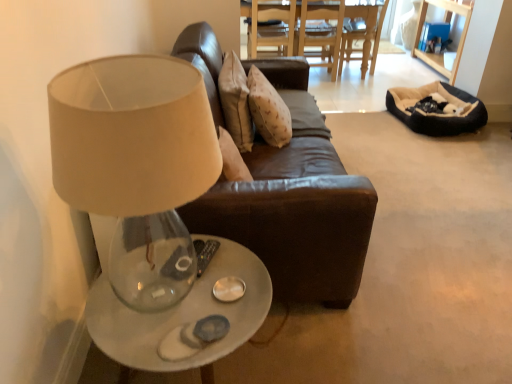
Find the location of a particular element. The width and height of the screenshot is (512, 384). beige plush bean bag at right is located at coordinates (437, 114).

This screenshot has width=512, height=384. What do you see at coordinates (182, 315) in the screenshot?
I see `translucent glass table at lower left, which is counted as the second table, starting from the right` at bounding box center [182, 315].

Identify the location of wooden dining table at center, the 1th table from the right. (362, 33).

Measure the distance between point (61, 177) and camera.

Point (61, 177) and camera are 36.34 inches apart.

Describe the element at coordinates (236, 102) in the screenshot. I see `beige fabric pillow at center` at that location.

The image size is (512, 384). Find the location of `beige fabric pillow at center`. beige fabric pillow at center is located at coordinates (236, 102).

This screenshot has width=512, height=384. I want to click on beige plush bean bag at right, so click(437, 114).

At what (x,y) coordinates should I click in order to perform the action: click on pillow below the wooden dining table at center, which is the 2th table in front-to-back order (from the image's perspective). Please return your answer as a coordinate pair (x, y). The image size is (512, 384). Looking at the image, I should click on (236, 102).

Which point is more distant from viewer, (377, 51) or (243, 119)?

Positioned behind is point (377, 51).

Choose the correct answer: Is wooden dining table at center, placed as the 1th table when sorted from back to front, inside beige fabric pillow at center or outside it?

wooden dining table at center, placed as the 1th table when sorted from back to front, is not inside beige fabric pillow at center, it's outside.

Is wooden dining table at center, placed as the second table when sorted from left to right, directly adjacent to beige fabric pillow at center?

No, wooden dining table at center, placed as the second table when sorted from left to right, is not with beige fabric pillow at center.

Is wooden dining table at center, which is the 2th table in front-to-back order, at the right side of brown leather chair at upper center?

Yes.

Considering the sizes of objects wooden dining table at center, placed as the second table when sorted from left to right, and brown leather chair at upper center in the image provided, who is thinner, wooden dining table at center, placed as the second table when sorted from left to right, or brown leather chair at upper center?

brown leather chair at upper center.

Are wooden dining table at center, placed as the 1th table when sorted from back to front, and brown leather chair at upper center located far from each other?

No.

From a real-world perspective, is translucent glass table at lower left, which is the second table in top-to-bottom order, physically located above or below wooden dining table at center, which is the 2th table in front-to-back order?

Clearly, from a real-world perspective, translucent glass table at lower left, which is the second table in top-to-bottom order, is below wooden dining table at center, which is the 2th table in front-to-back order.

From the image's perspective, between translucent glass table at lower left, which is counted as the second table, starting from the right, and wooden dining table at center, placed as the 2th table when sorted from bottom to top, which one is located above?

wooden dining table at center, placed as the 2th table when sorted from bottom to top, appears higher in the image.

Where is `table above the translucent glass table at lower left, positioned as the first table in front-to-back order (from the image's perspective)`? table above the translucent glass table at lower left, positioned as the first table in front-to-back order (from the image's perspective) is located at coordinates (362, 33).

Is translucent glass table at lower left, acting as the 2th table starting from the back, in front of or behind wooden dining table at center, placed as the 2th table when sorted from bottom to top, in the image?

Clearly, translucent glass table at lower left, acting as the 2th table starting from the back, is in front of wooden dining table at center, placed as the 2th table when sorted from bottom to top.

From the image's perspective, relative to translucent glass table at lower left, positioned as the first table in front-to-back order, is brown leather chair at upper center above or below?

Clearly, from the image's perspective, brown leather chair at upper center is above translucent glass table at lower left, positioned as the first table in front-to-back order.

Does brown leather chair at upper center have a greater height compared to translucent glass table at lower left, which is the second table in top-to-bottom order?

Yes.

From a real-world perspective, is brown leather chair at upper center physically above translucent glass table at lower left, which is the second table in top-to-bottom order?

Yes, from a real-world perspective, brown leather chair at upper center is above translucent glass table at lower left, which is the second table in top-to-bottom order.

Where is `chair on the right of translucent glass table at lower left, acting as the 2th table starting from the back`? This screenshot has height=384, width=512. chair on the right of translucent glass table at lower left, acting as the 2th table starting from the back is located at coordinates (269, 26).

Which object is wider, translucent glass table at lower left, the 1th table from the bottom, or beige fabric lampshade at upper left?

translucent glass table at lower left, the 1th table from the bottom, is wider.

Would you say translucent glass table at lower left, which is the second table in top-to-bottom order, contains beige fabric lampshade at upper left?

No, beige fabric lampshade at upper left is not inside translucent glass table at lower left, which is the second table in top-to-bottom order.

Which is in front, brown leather chair at upper center or wooden dining table at center, placed as the 2th table when sorted from bottom to top?

brown leather chair at upper center is more forward.

Between brown leather chair at upper center and wooden dining table at center, the first table from the top, which one has less height?

brown leather chair at upper center is shorter.

I want to click on table lying above the brown leather chair at upper center (from the image's perspective), so click(x=362, y=33).

From a real-world perspective, is brown leather chair at upper center beneath wooden dining table at center, placed as the second table when sorted from left to right?

Actually, brown leather chair at upper center is physically above wooden dining table at center, placed as the second table when sorted from left to right, in the real world.

Is beige fabric lampshade at upper left inside the boundaries of brown leather chair at upper center, or outside?

beige fabric lampshade at upper left exists outside the volume of brown leather chair at upper center.

Which is farther, (142, 125) or (259, 5)?

The point (259, 5) is more distant.

Who is taller, beige fabric lampshade at upper left or brown leather chair at upper center?

Standing taller between the two is beige fabric lampshade at upper left.

Locate an element on the screen. table that is on the right side of beige fabric pillow at center is located at coordinates (362, 33).

At what (x,y) coordinates should I click in order to perform the action: click on table above the brown leather chair at upper center (from the image's perspective). Please return your answer as a coordinate pair (x, y). Looking at the image, I should click on (362, 33).

Which object lies nearer to the anchor point beige plush bean bag at right, brown leather chair at upper center or translucent glass table at lower left, which ranks as the 1th table in left-to-right order?

brown leather chair at upper center is positioned closer to the anchor beige plush bean bag at right.

Which object lies nearer to the anchor point beige fabric lampshade at upper left, beige fabric pillow at center or wooden dining table at center, the 1th table from the right?

Based on the image, beige fabric pillow at center appears to be nearer to beige fabric lampshade at upper left.

Considering their positions, is beige plush bean bag at right positioned closer to beige fabric pillow at center than translucent glass table at lower left, which ranks as the 1th table in left-to-right order?

Among the two, translucent glass table at lower left, which ranks as the 1th table in left-to-right order, is located nearer to beige fabric pillow at center.

Which object lies nearer to the anchor point beige fabric lampshade at upper left, translucent glass table at lower left, which is the second table in top-to-bottom order, or beige plush bean bag at right?

translucent glass table at lower left, which is the second table in top-to-bottom order.

From the picture: Considering their positions, is beige fabric lampshade at upper left positioned closer to wooden dining table at center, placed as the 2th table when sorted from bottom to top, than brown leather chair at upper center?

Based on the image, brown leather chair at upper center appears to be nearer to wooden dining table at center, placed as the 2th table when sorted from bottom to top.

Estimate the real-world distances between objects in this image. Which object is further from translucent glass table at lower left, positioned as the first table in front-to-back order, beige plush bean bag at right or beige fabric lampshade at upper left?

beige plush bean bag at right is positioned further to the anchor translucent glass table at lower left, positioned as the first table in front-to-back order.

Looking at the image, which one is located further to beige fabric pillow at center, beige fabric lampshade at upper left or wooden dining table at center, the first table from the top?

wooden dining table at center, the first table from the top, lies further to beige fabric pillow at center than the other object.

From the image, which object appears to be farther from brown leather chair at upper center, beige fabric pillow at center or wooden dining table at center, the first table from the top?

beige fabric pillow at center is further to brown leather chair at upper center.

The width and height of the screenshot is (512, 384). In order to click on pillow between beige fabric lampshade at upper left and wooden dining table at center, placed as the 1th table when sorted from back to front, from front to back in this screenshot , I will do `click(236, 102)`.

The width and height of the screenshot is (512, 384). Find the location of `bean bag chair located between beige fabric pillow at center and wooden dining table at center, placed as the second table when sorted from left to right, in the depth direction`. bean bag chair located between beige fabric pillow at center and wooden dining table at center, placed as the second table when sorted from left to right, in the depth direction is located at coordinates (437, 114).

At what (x,y) coordinates should I click in order to perform the action: click on pillow positioned between translucent glass table at lower left, the 1th table from the bottom, and wooden dining table at center, the 1th table from the right, from near to far. Please return your answer as a coordinate pair (x, y). The width and height of the screenshot is (512, 384). Looking at the image, I should click on (236, 102).

The height and width of the screenshot is (384, 512). In order to click on chair between beige fabric pillow at center and wooden dining table at center, placed as the second table when sorted from left to right, along the z-axis in this screenshot , I will do `click(269, 26)`.